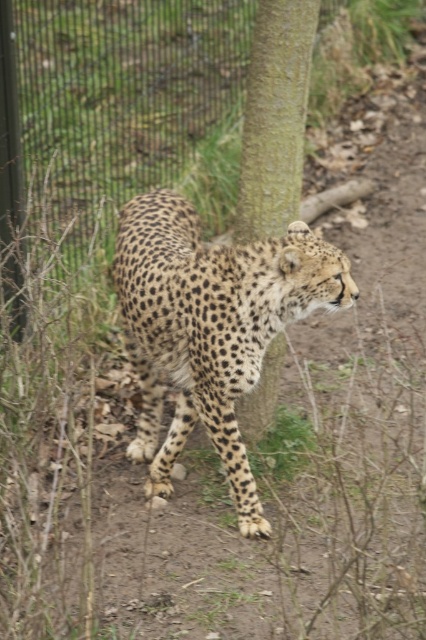
Question: Is spotted fur cheetah at center to the right of green textured bark at center from the viewer's perspective?

Choices:
 (A) yes
 (B) no

Answer: (B)

Question: Is spotted fur cheetah at center smaller than green textured bark at center?

Choices:
 (A) no
 (B) yes

Answer: (A)

Question: Can you confirm if spotted fur cheetah at center is positioned to the left of green textured bark at center?

Choices:
 (A) no
 (B) yes

Answer: (B)